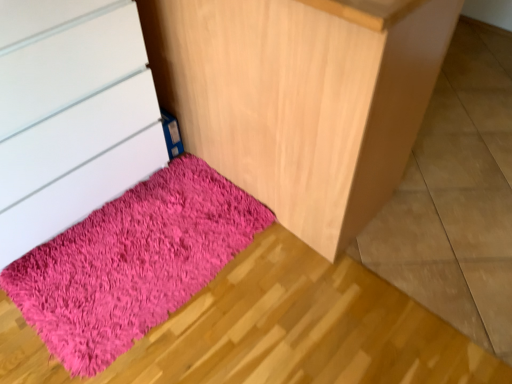
Question: Considering the relative sizes of shaggy pink rug at lower left and matte white chest of drawers at lower left in the image provided, is shaggy pink rug at lower left smaller than matte white chest of drawers at lower left?

Choices:
 (A) no
 (B) yes

Answer: (B)

Question: Is shaggy pink rug at lower left positioned far away from matte white chest of drawers at lower left?

Choices:
 (A) yes
 (B) no

Answer: (B)

Question: Is shaggy pink rug at lower left bigger than matte white chest of drawers at lower left?

Choices:
 (A) no
 (B) yes

Answer: (A)

Question: From the image's perspective, is shaggy pink rug at lower left below matte white chest of drawers at lower left?

Choices:
 (A) yes
 (B) no

Answer: (A)

Question: Can you confirm if shaggy pink rug at lower left is shorter than matte white chest of drawers at lower left?

Choices:
 (A) no
 (B) yes

Answer: (B)

Question: Is the position of shaggy pink rug at lower left less distant than that of matte white chest of drawers at lower left?

Choices:
 (A) no
 (B) yes

Answer: (A)

Question: Considering the relative sizes of matte white chest of drawers at lower left and fuzzy pink rug at lower left in the image provided, is matte white chest of drawers at lower left smaller than fuzzy pink rug at lower left?

Choices:
 (A) no
 (B) yes

Answer: (B)

Question: From a real-world perspective, does matte white chest of drawers at lower left stand above fuzzy pink rug at lower left?

Choices:
 (A) no
 (B) yes

Answer: (A)

Question: Is matte white chest of drawers at lower left looking in the opposite direction of fuzzy pink rug at lower left?

Choices:
 (A) no
 (B) yes

Answer: (A)

Question: Is matte white chest of drawers at lower left bigger than fuzzy pink rug at lower left?

Choices:
 (A) no
 (B) yes

Answer: (A)

Question: From the image's perspective, is matte white chest of drawers at lower left on top of fuzzy pink rug at lower left?

Choices:
 (A) yes
 (B) no

Answer: (B)

Question: Is matte white chest of drawers at lower left closer to camera compared to fuzzy pink rug at lower left?

Choices:
 (A) yes
 (B) no

Answer: (B)

Question: From the image's perspective, is fuzzy pink rug at lower left below matte white chest of drawers at lower left?

Choices:
 (A) yes
 (B) no

Answer: (B)